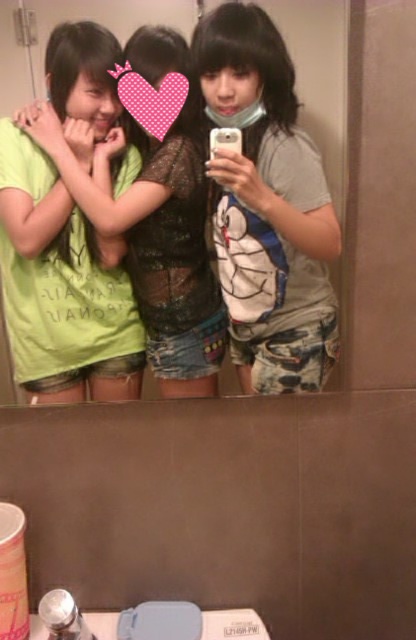
Question: Among these objects, which one is farthest from the camera?

Choices:
 (A) green matte t-shirt at center
 (B) matte gray t-shirt at center

Answer: (A)

Question: Which point is closer to the camera?

Choices:
 (A) (215, 68)
 (B) (156, 84)

Answer: (A)

Question: Does matte gray t-shirt at center have a larger size compared to green matte t-shirt at center?

Choices:
 (A) no
 (B) yes

Answer: (A)

Question: In this image, where is matte gray t-shirt at center located relative to green matte t-shirt at center?

Choices:
 (A) left
 (B) right

Answer: (B)

Question: Which of the following is the closest to the observer?

Choices:
 (A) (322, 211)
 (B) (205, 237)

Answer: (A)

Question: Is matte gray t-shirt at center wider than green matte t-shirt at center?

Choices:
 (A) yes
 (B) no

Answer: (B)